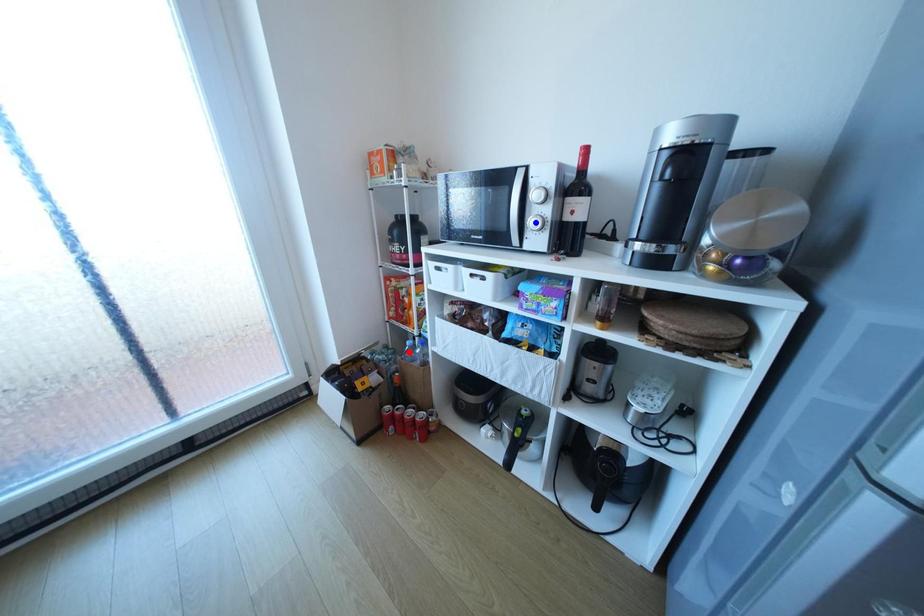
Question: Which of the two points in the image is closer to the camera?

Choices:
 (A) Blue point is closer.
 (B) Red point is closer.

Answer: (A)